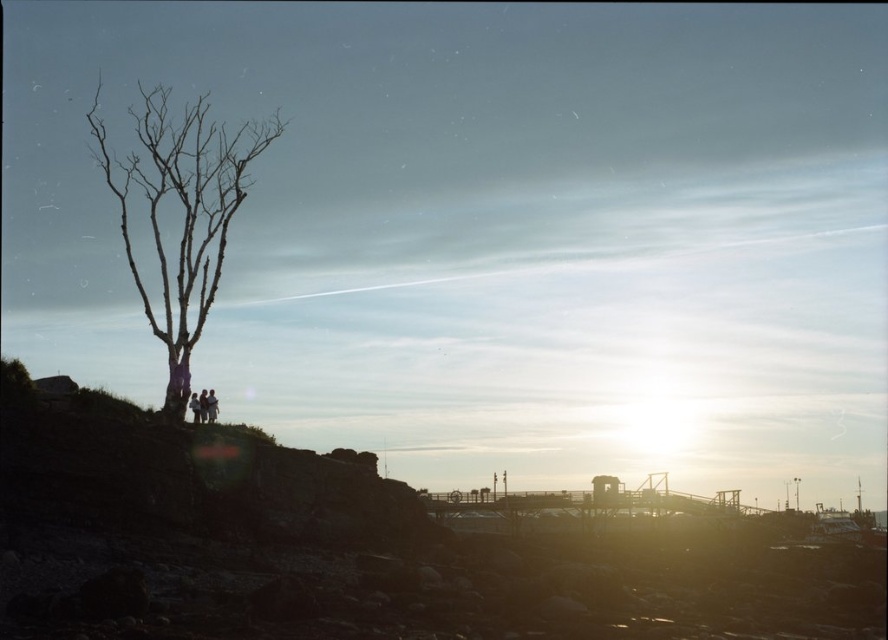
You are a hiker trying to navigate between two points marked on a map. The first point is at coordinate point(211, 419) and the second is at point(191, 408). According to the scene, which point is closer to the leafless tree on the left?

Point(191, 408) is closer to the leafless tree on the left because it is in front of point(211, 419), which is behind it.

You are a photographer planning to capture a wide shot of the coastal scene. You want to ensure that both the bare wood tree at left and the dark clothing figure at left are fully visible in the frame. Based on their sizes, which object should you focus on to ensure both are included?

The bare wood tree at left is wider than the dark clothing figure at left, so focusing on the tree will ensure both are included as it occupies more space in the frame.

You are a photographer trying to capture the scene with a camera. You want to ensure that both the bare wood tree at left and the dark clothing figure at left are visible in your shot. Based on their sizes, which object should you focus on first to ensure both are in frame?

The bare wood tree at left is taller than the dark clothing figure at left, so focusing on the tree first will help ensure both are in frame as the tree occupies more space.